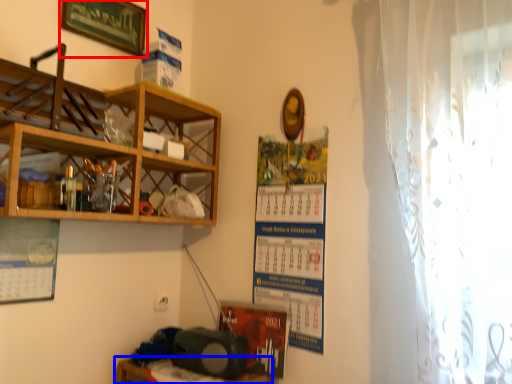
Question: Which object appears farthest to the camera in this image, picture frame (highlighted by a red box) or table (highlighted by a blue box)?

Choices:
 (A) picture frame
 (B) table

Answer: (A)